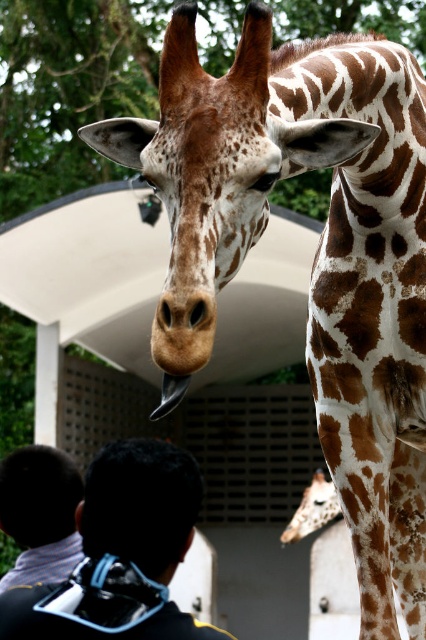
Question: Considering the relative positions of black matte mask at upper center and spotted fur at center in the image provided, where is black matte mask at upper center located with respect to spotted fur at center?

Choices:
 (A) left
 (B) right

Answer: (A)

Question: Among these objects, which one is nearest to the camera?

Choices:
 (A) black matte hair at center
 (B) black matte mask at upper center
 (C) dark brown hair at lower left
 (D) spotted fur at center

Answer: (B)

Question: Which point is farther from the camera taking this photo?

Choices:
 (A) (167, 518)
 (B) (324, 513)

Answer: (B)

Question: Does black matte mask at upper center have a greater width compared to dark brown hair at lower left?

Choices:
 (A) no
 (B) yes

Answer: (B)

Question: Which point is farther to the camera?

Choices:
 (A) black matte hair at center
 (B) spotted fur at center
 (C) dark brown hair at lower left

Answer: (B)

Question: Does black matte hair at center appear on the right side of spotted fur at center?

Choices:
 (A) no
 (B) yes

Answer: (A)